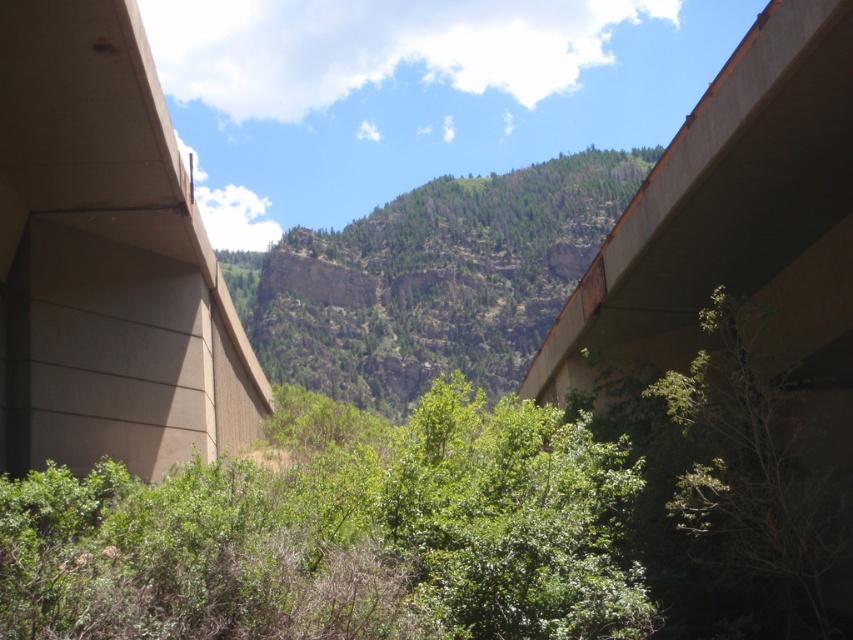
Question: Which object appears farthest from the camera in this image?

Choices:
 (A) concrete bridge at upper right
 (B) green rocky mountain at center

Answer: (B)

Question: Is concrete overpass at left thinner than green rocky mountain at center?

Choices:
 (A) no
 (B) yes

Answer: (B)

Question: Which point is closer to the camera taking this photo?

Choices:
 (A) (538, 214)
 (B) (767, 241)

Answer: (B)

Question: Can you confirm if green rocky mountain at center is smaller than concrete bridge at upper right?

Choices:
 (A) no
 (B) yes

Answer: (A)

Question: Is concrete overpass at left thinner than green rocky mountain at center?

Choices:
 (A) no
 (B) yes

Answer: (B)

Question: Which point is farther to the camera?

Choices:
 (A) concrete overpass at left
 (B) green leafy tree at lower right

Answer: (B)